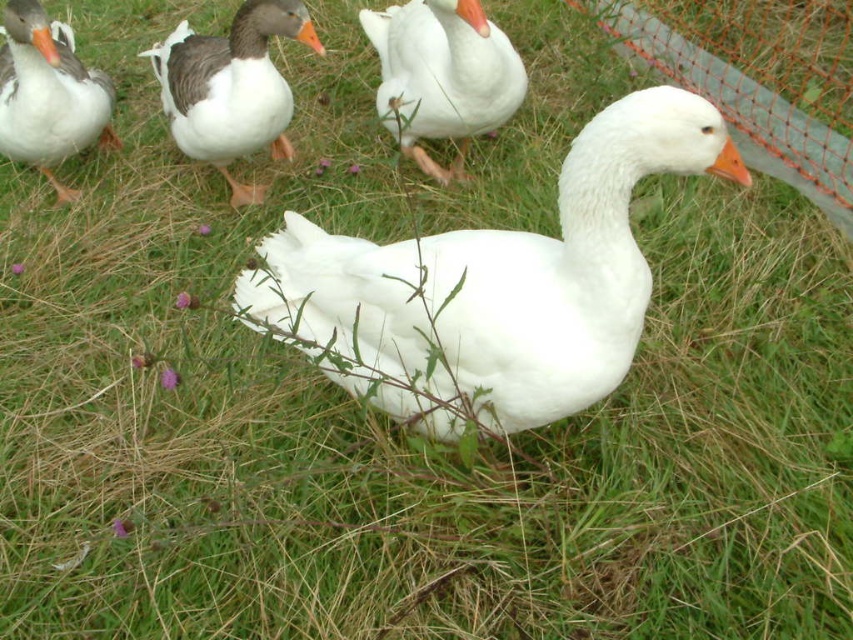
The width and height of the screenshot is (853, 640). I want to click on white matte goose at upper center, so click(x=442, y=76).

Can you confirm if white matte goose at upper center is positioned below matte gray duck at upper left?

No.

Is point (387, 20) in front of point (39, 52)?

No, it is behind (39, 52).

Locate an element on the screen. The height and width of the screenshot is (640, 853). white matte goose at upper center is located at coordinates (442, 76).

Between point (242, 88) and point (90, 92), which one is positioned behind?

Point (90, 92)

Can you confirm if gray matte duck at upper left is bigger than matte gray duck at upper left?

Yes, gray matte duck at upper left is bigger than matte gray duck at upper left.

Who is more distant from viewer, (280, 120) or (3, 51)?

Positioned behind is point (3, 51).

The image size is (853, 640). What are the coordinates of `gray matte duck at upper left` in the screenshot? It's located at (231, 88).

Can you confirm if white matte goose at center is shorter than gray matte duck at upper left?

Indeed, white matte goose at center has a lesser height compared to gray matte duck at upper left.

Can you confirm if white matte goose at center is thinner than gray matte duck at upper left?

No.

Describe the element at coordinates (492, 285) in the screenshot. The height and width of the screenshot is (640, 853). I see `white matte goose at center` at that location.

The height and width of the screenshot is (640, 853). In order to click on white matte goose at center in this screenshot , I will do `click(492, 285)`.